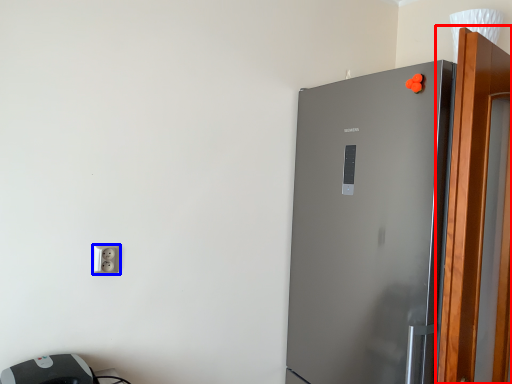
Question: Which of the following is the closest to the observer, screen door (highlighted by a red box) or socket (highlighted by a blue box)?

Choices:
 (A) screen door
 (B) socket

Answer: (A)